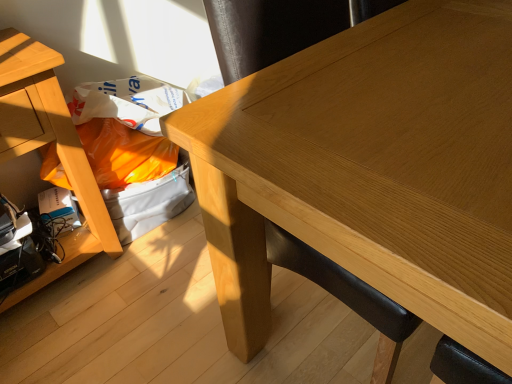
Question: Is light brown wood table at center, arranged as the second table when viewed from the left, turned away from light brown wood table at left, positioned as the second table in right-to-left order?

Choices:
 (A) yes
 (B) no

Answer: (A)

Question: Is light brown wood table at center, arranged as the second table when viewed from the left, at the left side of light brown wood table at left, which appears as the 1th table when viewed from the left?

Choices:
 (A) no
 (B) yes

Answer: (A)

Question: Is light brown wood table at center, which ranks as the first table in right-to-left order, touching light brown wood table at left, positioned as the second table in right-to-left order?

Choices:
 (A) yes
 (B) no

Answer: (B)

Question: Can you confirm if light brown wood table at center, which ranks as the first table in right-to-left order, is positioned to the right of light brown wood table at left, which appears as the 1th table when viewed from the left?

Choices:
 (A) no
 (B) yes

Answer: (B)

Question: Can you confirm if light brown wood table at center, which ranks as the first table in right-to-left order, is shorter than light brown wood table at left, which appears as the 1th table when viewed from the left?

Choices:
 (A) no
 (B) yes

Answer: (A)

Question: Is light brown wood table at center, which ranks as the first table in right-to-left order, oriented towards light brown wood table at left, positioned as the second table in right-to-left order?

Choices:
 (A) yes
 (B) no

Answer: (B)

Question: Is light brown wood table at left, which appears as the 1th table when viewed from the left, smaller than light brown wood table at center, arranged as the second table when viewed from the left?

Choices:
 (A) no
 (B) yes

Answer: (B)

Question: Does light brown wood table at left, positioned as the second table in right-to-left order, have a larger size compared to light brown wood table at center, which ranks as the first table in right-to-left order?

Choices:
 (A) yes
 (B) no

Answer: (B)

Question: Can you confirm if light brown wood table at left, positioned as the second table in right-to-left order, is thinner than light brown wood table at center, which ranks as the first table in right-to-left order?

Choices:
 (A) yes
 (B) no

Answer: (A)

Question: Would you consider light brown wood table at left, which appears as the 1th table when viewed from the left, to be distant from light brown wood table at center, arranged as the second table when viewed from the left?

Choices:
 (A) yes
 (B) no

Answer: (B)

Question: Does light brown wood table at left, which appears as the 1th table when viewed from the left, appear on the right side of light brown wood table at center, arranged as the second table when viewed from the left?

Choices:
 (A) no
 (B) yes

Answer: (A)

Question: Is light brown wood table at left, which appears as the 1th table when viewed from the left, next to light brown wood table at center, arranged as the second table when viewed from the left?

Choices:
 (A) yes
 (B) no

Answer: (B)

Question: Relative to light brown wood table at center, arranged as the second table when viewed from the left, is light brown wood table at left, which appears as the 1th table when viewed from the left, in front or behind?

Choices:
 (A) behind
 (B) front

Answer: (A)